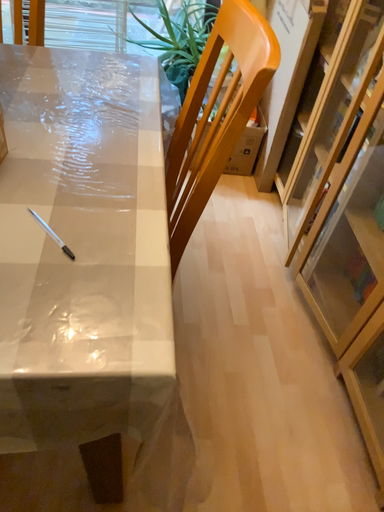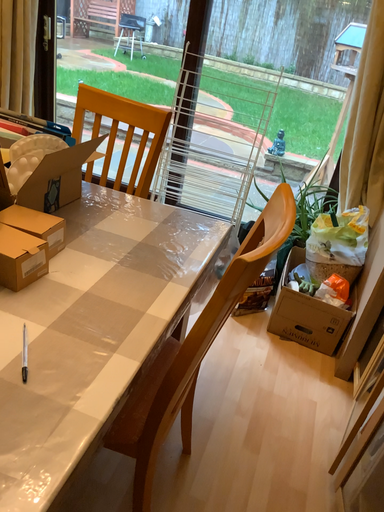
Question: Which way did the camera rotate in the video?

Choices:
 (A) rotated left
 (B) rotated right

Answer: (A)